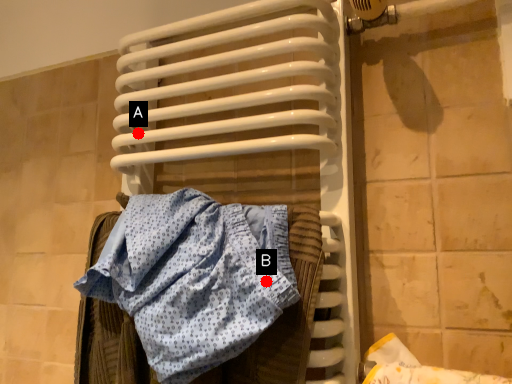
Question: Two points are circled on the image, labeled by A and B beside each circle. Among these points, which one is nearest to the camera?

Choices:
 (A) A is closer
 (B) B is closer

Answer: (B)